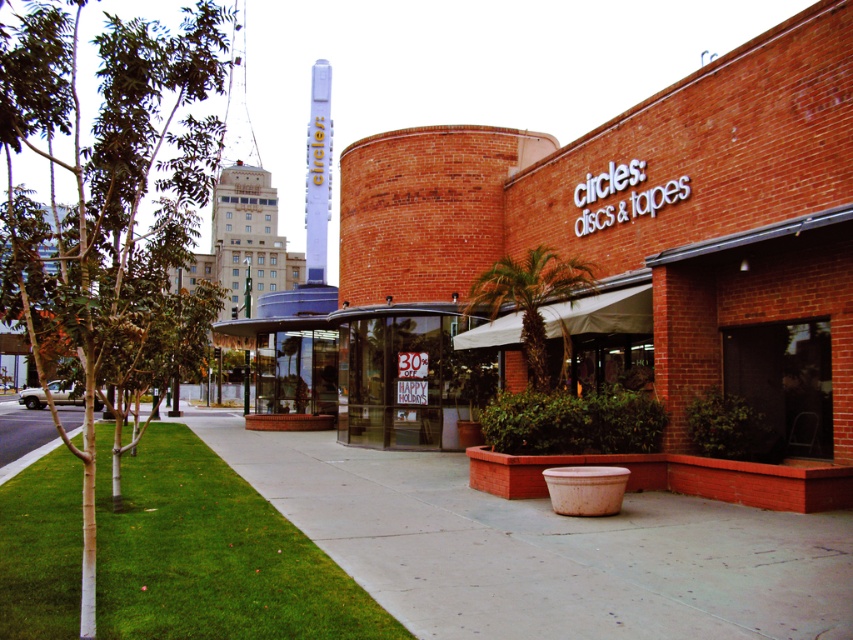
You are a delivery person trying to park your 1.2 meter wide cart between the concrete at center and the green leafy palm at center. Can your cart fit in the space between them?

The concrete at center is wider than the green leafy palm at center. Therefore, the space between them is narrower than 1.2 meters, so the cart cannot fit.

You are a delivery person trying to park your bike. You see the concrete at center and the green leafy tree at left. Which surface can you safely park your bike on?

The concrete at center is positioned under green leafy tree at left, so you can park your bike on the concrete at center as it provides a stable surface.

You are a delivery person with a cart that is 2 meters wide. You need to navigate through the space between the concrete at center and the green leafy palm at center. Can your cart fit through the space between them?

The concrete at center and green leafy palm at center are 3.64 meters apart from each other. Since the cart is 2 meters wide, it can easily fit through the space between them as there is enough clearance.